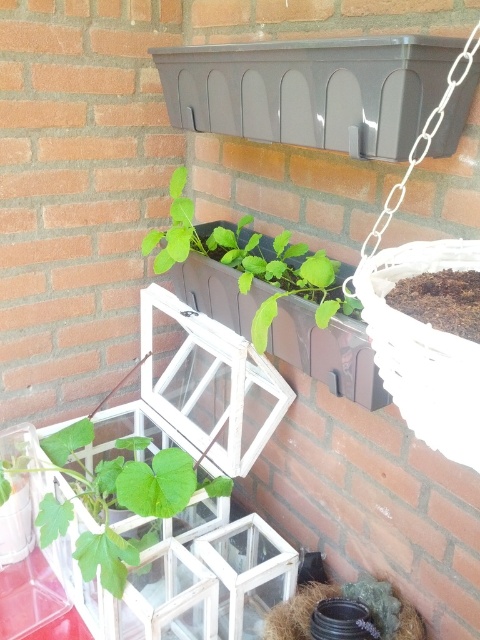
You are a gardener who wants to replace the smaller plant between the green matte leafy plant at center and the green matte plant at center with a new one. Which plant should you replace?

The green matte leafy plant at center is smaller compared to the green matte plant at center, so you should replace the green matte leafy plant at center.

You are a gardener checking the spacing between two plants on a shelf. You have the green matte leafy plant at center and the green matte plant at center. Which one is wider?

The green matte leafy plant at center might be wider than the green matte plant at center according to the description.

You are standing in front of the brick wall with gardening elements. You see a green matte leafy plant at center and a green matte plant at center. Which one is closer to you?

The green matte leafy plant at center is closer to you because it is further to the viewer than the green matte plant at center.